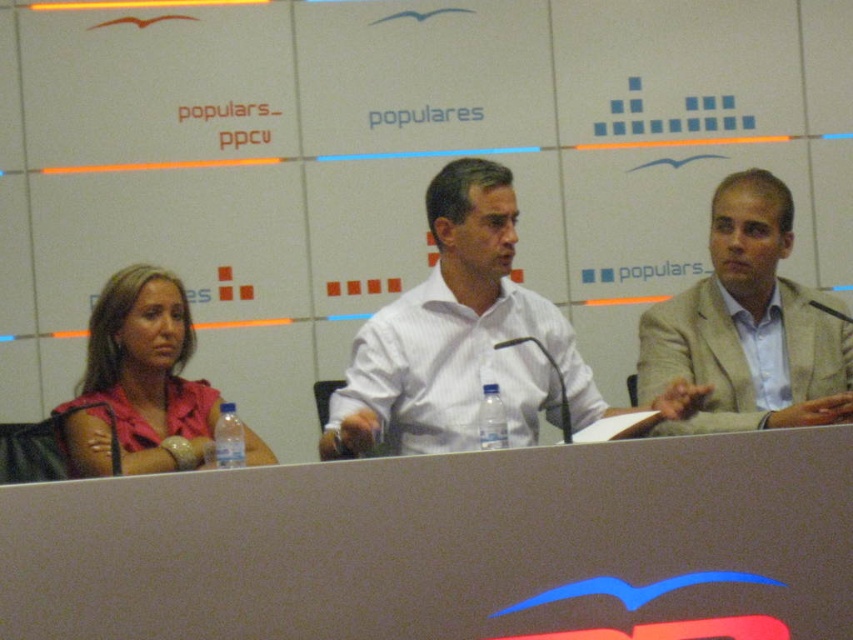
Can you confirm if white striped shirt at center is taller than pink fabric shirt at left?

Correct, white striped shirt at center is much taller as pink fabric shirt at left.

Which is behind, point (467, 380) or point (90, 380)?

Positioned behind is point (90, 380).

This screenshot has height=640, width=853. What do you see at coordinates (460, 339) in the screenshot?
I see `white striped shirt at center` at bounding box center [460, 339].

Locate an element on the screen. The width and height of the screenshot is (853, 640). white striped shirt at center is located at coordinates (460, 339).

Is point (390, 348) positioned before point (744, 426)?

No.

Does white striped shirt at center have a lesser width compared to light beige suit at right?

No, white striped shirt at center is not thinner than light beige suit at right.

Is point (352, 404) farther from viewer compared to point (676, 326)?

That is False.

The image size is (853, 640). What are the coordinates of `white striped shirt at center` in the screenshot? It's located at (460, 339).

Who is more forward, (764, 298) or (123, 452)?

Point (123, 452)

Measure the distance between light beige suit at right and pink fabric shirt at left.

4.26 feet

Measure the distance between light beige suit at right and camera.

light beige suit at right is 2.24 meters away from camera.

Where is `light beige suit at right`? The image size is (853, 640). light beige suit at right is located at coordinates (749, 324).